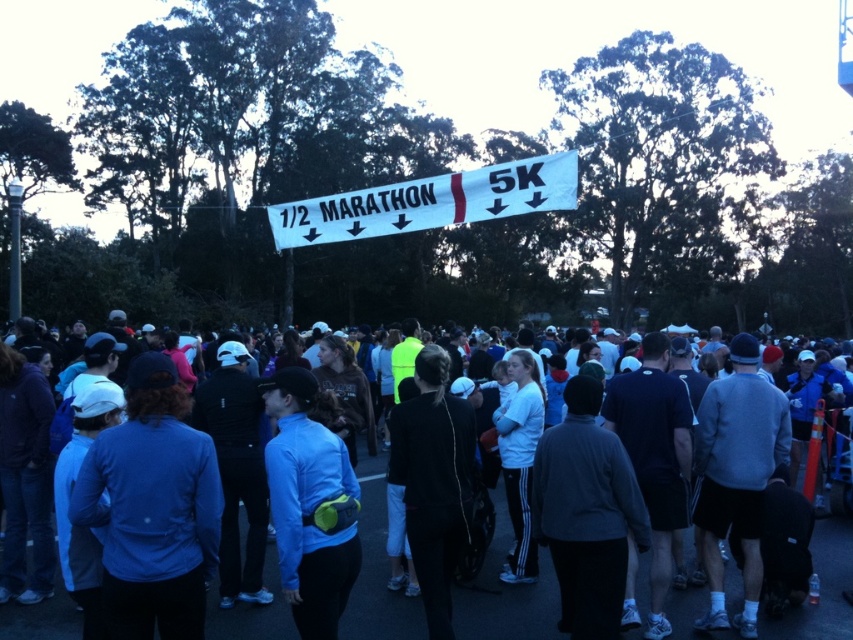
You are a participant at the marathon event and you see the dark blue fleece at center and the white fabric banner at center. Which object is positioned to the right side from your perspective?

The dark blue fleece at center is positioned to the right of the white fabric banner at center.

You are a participant at the marathon event. You see the dark blue fleece at center and the white fabric banner at center. Which item is closer to the ground?

The dark blue fleece at center is positioned under the white fabric banner at center, so it is closer to the ground.